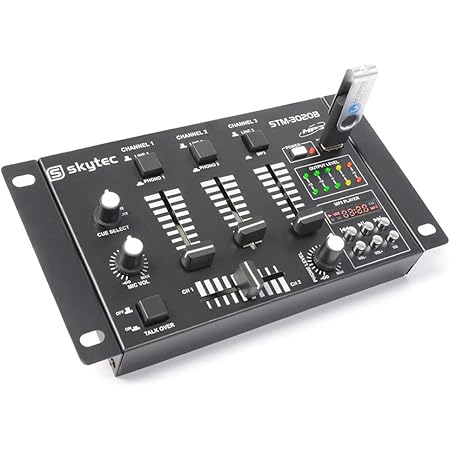
The width and height of the screenshot is (450, 450). What are the coordinates of `red led light` in the screenshot? It's located at tap(360, 180).